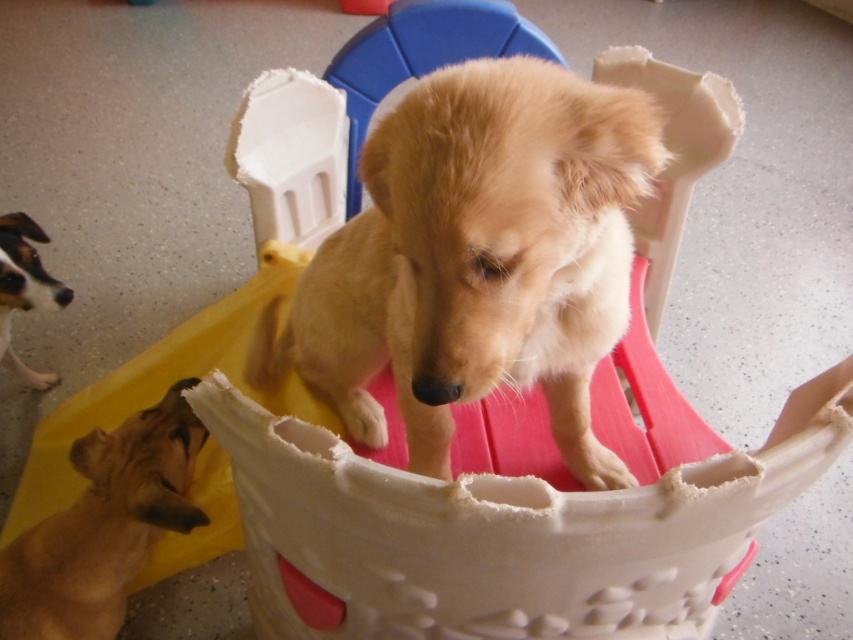
Question: Can you confirm if brown furry dog at upper center is bigger than white fur dog at lower left?

Choices:
 (A) yes
 (B) no

Answer: (B)

Question: Among these points, which one is nearest to the camera?

Choices:
 (A) (459, 356)
 (B) (1, 336)
 (C) (67, 582)

Answer: (A)

Question: Which object appears closest to the camera in this image?

Choices:
 (A) brown furry dog at upper center
 (B) white fur dog at lower left
 (C) golden fur puppy at center

Answer: (C)

Question: Does golden fur puppy at center come behind brown furry dog at upper center?

Choices:
 (A) yes
 (B) no

Answer: (B)

Question: Can you confirm if brown furry dog at upper center is bigger than white fur dog at lower left?

Choices:
 (A) no
 (B) yes

Answer: (A)

Question: Which of the following is the farthest from the observer?

Choices:
 (A) (44, 576)
 (B) (572, 291)
 (C) (3, 317)

Answer: (C)